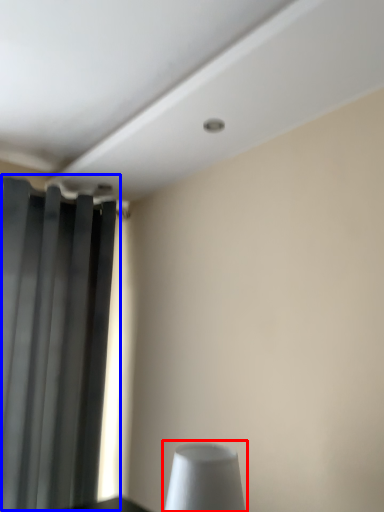
Question: Which point is closer to the camera, table lamp (highlighted by a red box) or curtain (highlighted by a blue box)?

Choices:
 (A) table lamp
 (B) curtain

Answer: (A)